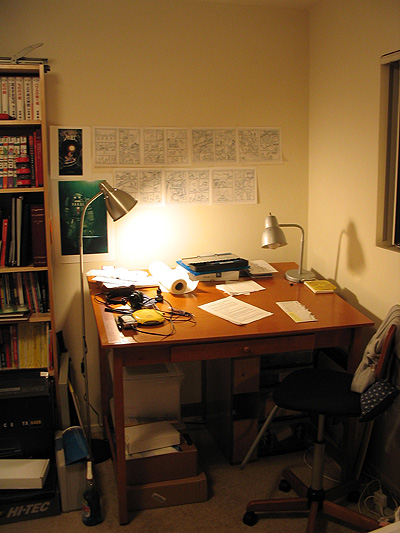
Image resolution: width=400 pixels, height=533 pixels. I want to click on knob to open drawer, so click(247, 350).